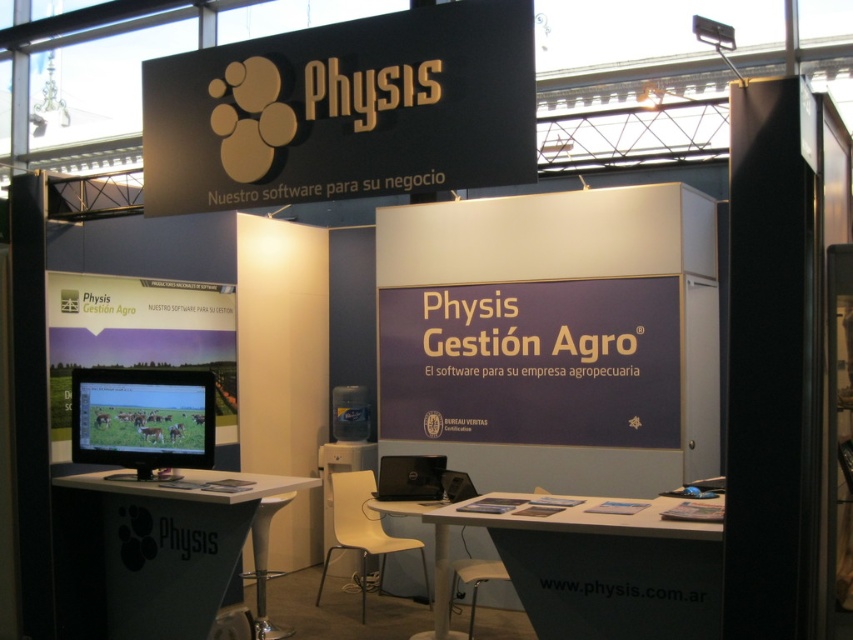
Is white matte table at center positioned in front of matte plastic signage at left?

That is True.

Where is `white matte table at center`? The image size is (853, 640). white matte table at center is located at coordinates (149, 554).

Locate an element on the screen. This screenshot has width=853, height=640. white matte table at center is located at coordinates (149, 554).

Is purple matte sign at center above white matte table at center?

Yes.

How distant is purple matte sign at center from white matte table at center?

1.92 meters

Who is more forward, (569, 442) or (128, 618)?

Point (128, 618) is more forward.

Image resolution: width=853 pixels, height=640 pixels. I want to click on purple matte sign at center, so coord(532,362).

Which is above, black matte sign at upper center or white plastic table at center?

black matte sign at upper center is above.

Does black matte sign at upper center have a larger size compared to white plastic table at center?

Yes, black matte sign at upper center is bigger than white plastic table at center.

At what (x,y) coordinates should I click in order to perform the action: click on black matte sign at upper center. Please return your answer as a coordinate pair (x, y). The height and width of the screenshot is (640, 853). Looking at the image, I should click on (344, 109).

I want to click on black matte sign at upper center, so click(x=344, y=109).